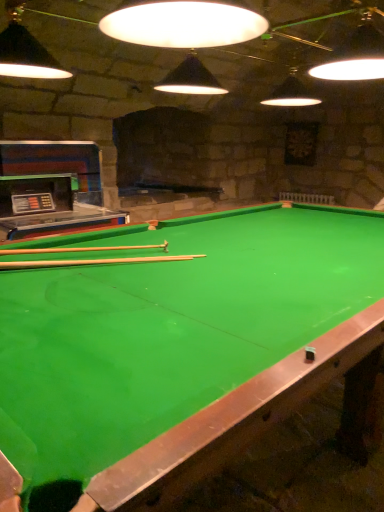
Question: Considering the relative positions of wooden cue at center, arranged as the 1th cue when ordered from the bottom, and green felt billiard table at center in the image provided, is wooden cue at center, arranged as the 1th cue when ordered from the bottom, behind green felt billiard table at center?

Choices:
 (A) yes
 (B) no

Answer: (A)

Question: From the image's perspective, is wooden cue at center, arranged as the 1th cue when ordered from the bottom, under green felt billiard table at center?

Choices:
 (A) yes
 (B) no

Answer: (B)

Question: Is wooden cue at center, which is the second cue in top-to-bottom order, smaller than green felt billiard table at center?

Choices:
 (A) yes
 (B) no

Answer: (A)

Question: From the image's perspective, is wooden cue at center, which is the second cue in top-to-bottom order, on green felt billiard table at center?

Choices:
 (A) no
 (B) yes

Answer: (B)

Question: Is wooden cue at center, arranged as the 1th cue when ordered from the bottom, outside green felt billiard table at center?

Choices:
 (A) no
 (B) yes

Answer: (A)

Question: Is wooden cue at center, positioned as the second cue in bottom-to-top order, not close to green felt billiard table at center?

Choices:
 (A) no
 (B) yes

Answer: (A)

Question: From the image's perspective, is wooden cue at center, which is the first cue from top to bottom, located beneath green felt billiard table at center?

Choices:
 (A) yes
 (B) no

Answer: (B)

Question: Considering the relative positions of wooden cue at center, positioned as the second cue in bottom-to-top order, and green felt billiard table at center in the image provided, is wooden cue at center, positioned as the second cue in bottom-to-top order, to the left of green felt billiard table at center from the viewer's perspective?

Choices:
 (A) no
 (B) yes

Answer: (B)

Question: Is the position of wooden cue at center, which is the first cue from top to bottom, more distant than that of green felt billiard table at center?

Choices:
 (A) yes
 (B) no

Answer: (A)

Question: Can you see wooden cue at center, positioned as the second cue in bottom-to-top order, touching green felt billiard table at center?

Choices:
 (A) no
 (B) yes

Answer: (A)

Question: Is wooden cue at center, which is the first cue from top to bottom, completely or partially outside of green felt billiard table at center?

Choices:
 (A) yes
 (B) no

Answer: (B)

Question: Considering the relative sizes of green felt billiard table at center and wooden cue at center, which is the second cue in top-to-bottom order, in the image provided, is green felt billiard table at center wider than wooden cue at center, which is the second cue in top-to-bottom order,?

Choices:
 (A) yes
 (B) no

Answer: (A)